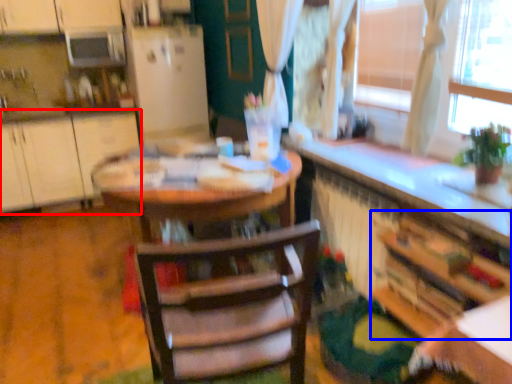
Question: Which object appears closest to the camera in this image, cabinetry (highlighted by a red box) or cabinetry (highlighted by a blue box)?

Choices:
 (A) cabinetry
 (B) cabinetry

Answer: (B)